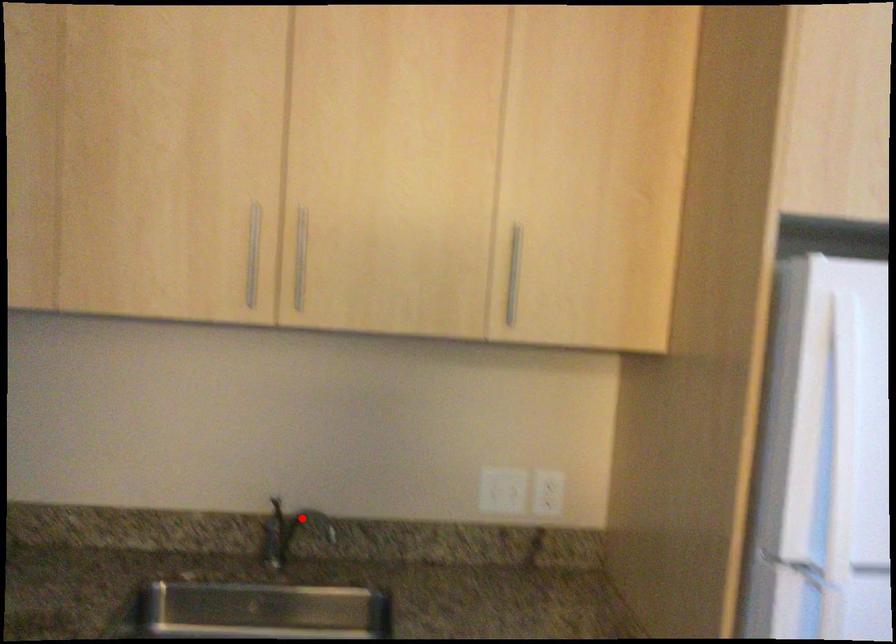
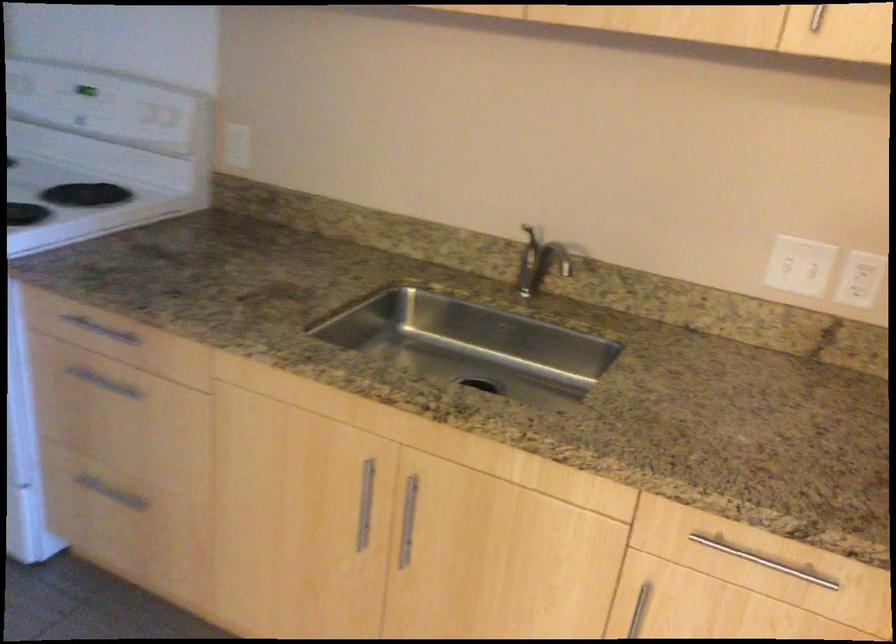
The point at the highlighted location is marked in the first image. Where is the corresponding point in the second image?

(545, 251)